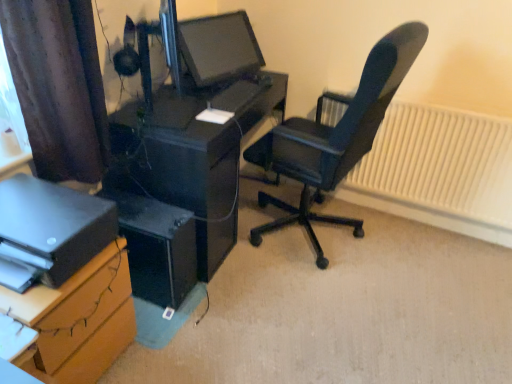
Question: Can you confirm if black glossy desk at center, the 1th desk in the back-to-front sequence, is smaller than matte black printer at lower left?

Choices:
 (A) no
 (B) yes

Answer: (A)

Question: Does black glossy desk at center, acting as the 2th desk starting from the front, turn towards matte black printer at lower left?

Choices:
 (A) yes
 (B) no

Answer: (B)

Question: Is black glossy desk at center, acting as the 2th desk starting from the front, outside matte black printer at lower left?

Choices:
 (A) no
 (B) yes

Answer: (B)

Question: Considering the relative positions of black glossy desk at center, acting as the 2th desk starting from the front, and matte black printer at lower left in the image provided, is black glossy desk at center, acting as the 2th desk starting from the front, to the left of matte black printer at lower left from the viewer's perspective?

Choices:
 (A) no
 (B) yes

Answer: (A)

Question: Does black glossy desk at center, the 1th desk in the back-to-front sequence, contain matte black printer at lower left?

Choices:
 (A) no
 (B) yes

Answer: (A)

Question: Does black glossy desk at center, acting as the 2th desk starting from the front, have a greater width compared to matte black printer at lower left?

Choices:
 (A) yes
 (B) no

Answer: (A)

Question: Is brown cardboard at lower left, which appears as the first desk when viewed from the front, outside brown fabric curtain at upper left?

Choices:
 (A) no
 (B) yes

Answer: (B)

Question: Can you confirm if brown cardboard at lower left, the second desk from the back, is thinner than brown fabric curtain at upper left?

Choices:
 (A) yes
 (B) no

Answer: (B)

Question: Could you tell me if brown cardboard at lower left, the second desk from the back, is turned towards brown fabric curtain at upper left?

Choices:
 (A) yes
 (B) no

Answer: (B)

Question: Does brown cardboard at lower left, the second desk from the back, have a lesser height compared to brown fabric curtain at upper left?

Choices:
 (A) yes
 (B) no

Answer: (A)

Question: From the image's perspective, is brown cardboard at lower left, which appears as the first desk when viewed from the front, below brown fabric curtain at upper left?

Choices:
 (A) no
 (B) yes

Answer: (B)

Question: Does brown cardboard at lower left, which appears as the first desk when viewed from the front, have a larger size compared to brown fabric curtain at upper left?

Choices:
 (A) yes
 (B) no

Answer: (A)

Question: Is white textured radiator at right bigger than matte black printer at lower left?

Choices:
 (A) no
 (B) yes

Answer: (B)